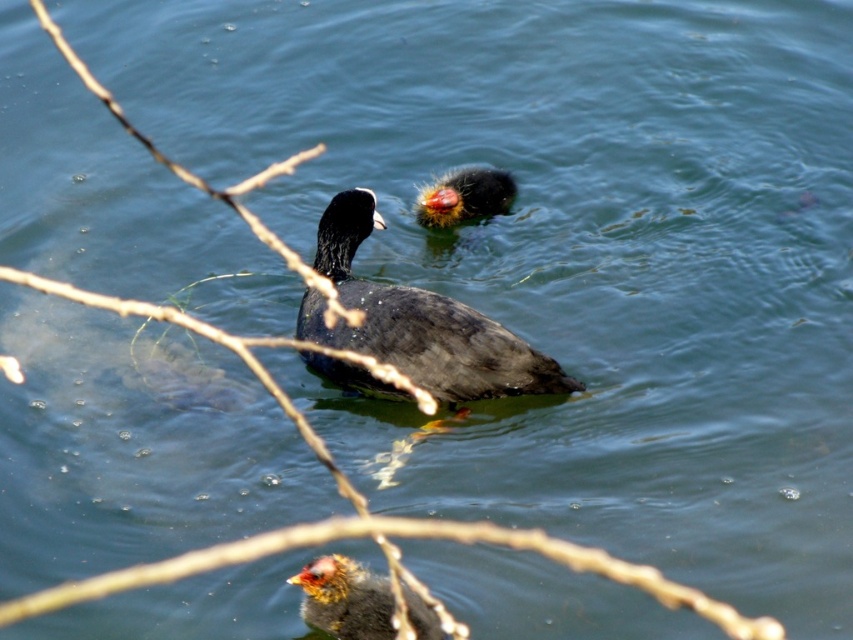
You are a wildlife photographer trying to capture a photo of the matte black duck at center and the fluffy black duckling at upper center. Since you want to ensure both are in focus, you need to know their sizes. Which one is wider?

The matte black duck at center is wider than the fluffy black duckling at upper center.

You are a photographer trying to capture both the brown fuzzy duckling at lower center and the fluffy black duckling at upper center in a single shot. Based on their positions, which duckling is positioned lower in the frame?

The brown fuzzy duckling at lower center is positioned lower in the frame than the fluffy black duckling at upper center.

You are a photographer trying to capture the matte black duck at center and the brown fuzzy duckling at lower center in a single shot. Based on their positions, which duck is closer to the water surface?

The matte black duck at center is above the brown fuzzy duckling at lower center, so it is closer to the water surface.